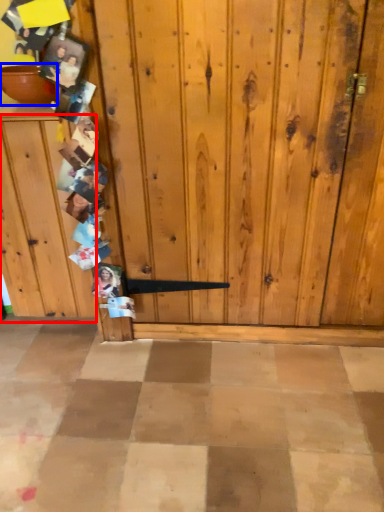
Question: Which object is further to the camera taking this photo, dresser (highlighted by a red box) or bowl (highlighted by a blue box)?

Choices:
 (A) dresser
 (B) bowl

Answer: (B)